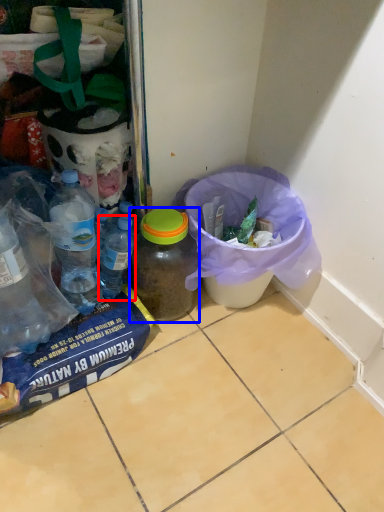
Question: Which of the following is the farthest to the observer, bottle (highlighted by a red box) or bottle (highlighted by a blue box)?

Choices:
 (A) bottle
 (B) bottle

Answer: (A)